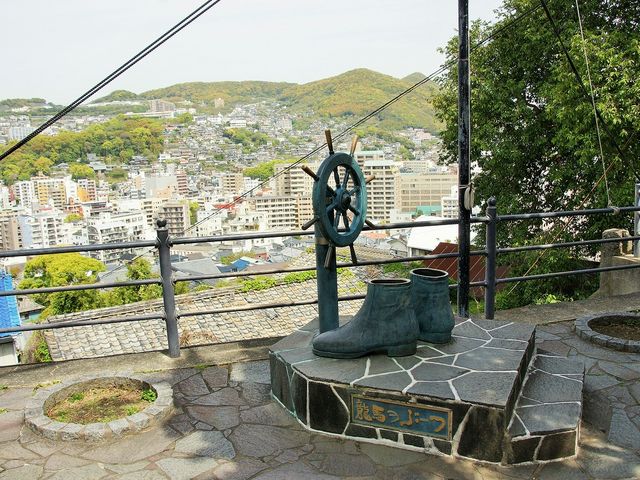
Where is `pedestal`? The width and height of the screenshot is (640, 480). pedestal is located at coordinates (412, 370).